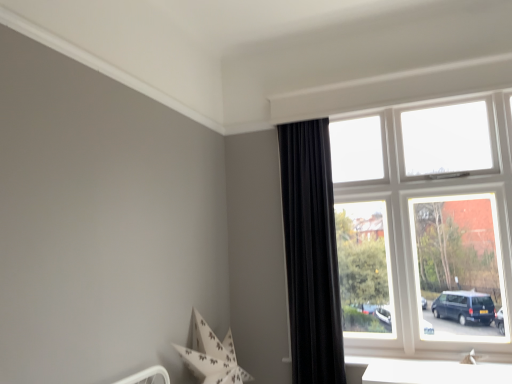
Where is `blank space situated above black velvet curtain at right (from a real-world perspective)`? This screenshot has width=512, height=384. blank space situated above black velvet curtain at right (from a real-world perspective) is located at coordinates (302, 107).